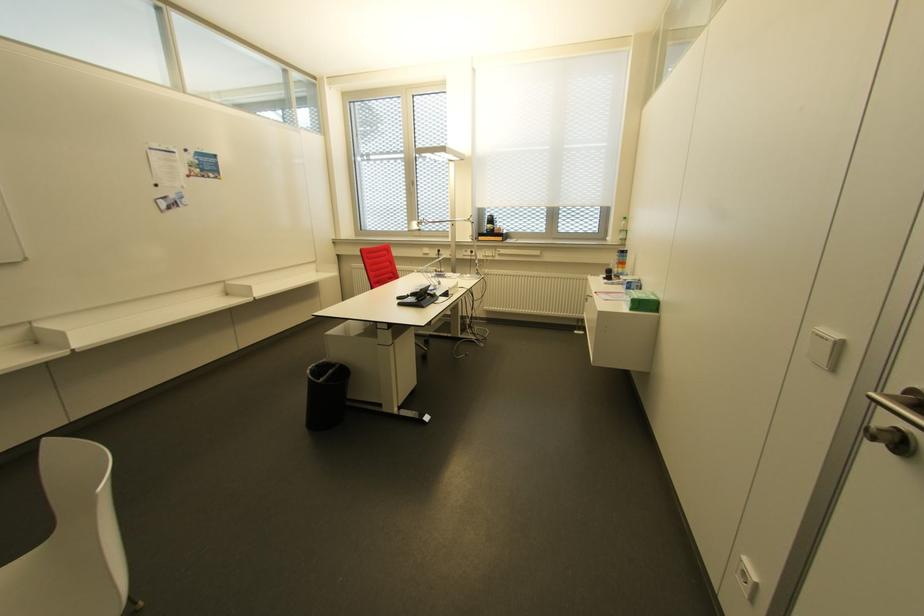
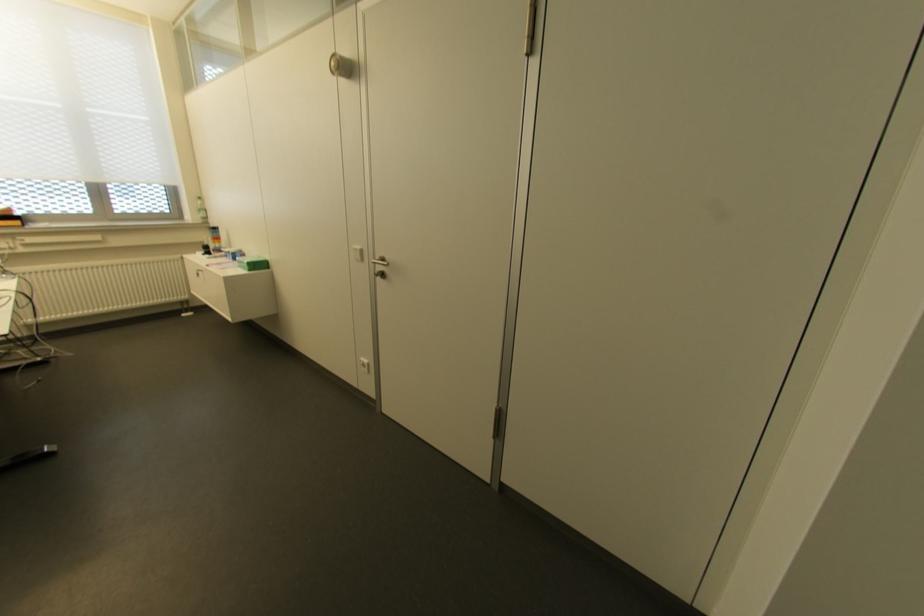
Find the pixel in the second image that matches point (615, 267) in the first image.

(213, 243)